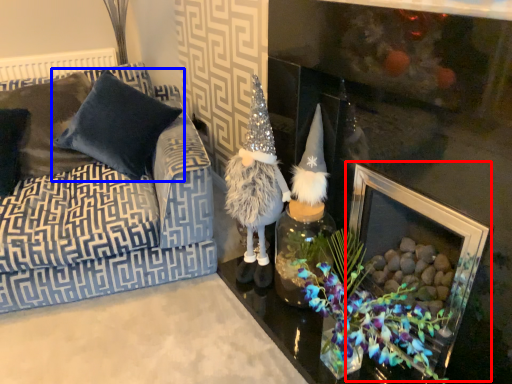
Question: Which object is further to the camera taking this photo, picture frame (highlighted by a red box) or pillow (highlighted by a blue box)?

Choices:
 (A) picture frame
 (B) pillow

Answer: (B)